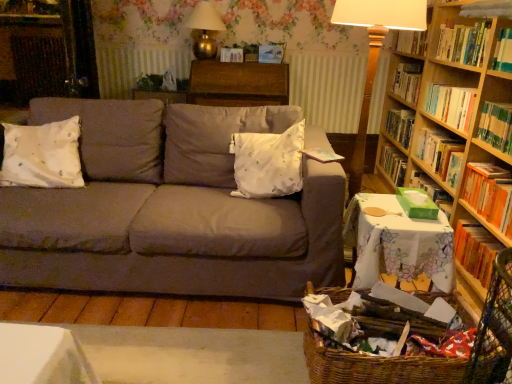
Question: From a real-world perspective, is hardcover book at right, which ranks as the first book in bottom-to-top order, positioned over woven brown basket at lower right based on gravity?

Choices:
 (A) no
 (B) yes

Answer: (B)

Question: Does hardcover book at right, which ranks as the first book in bottom-to-top order, contain woven brown basket at lower right?

Choices:
 (A) yes
 (B) no

Answer: (B)

Question: Is hardcover book at right, which ranks as the first book in bottom-to-top order, closer to the viewer compared to woven brown basket at lower right?

Choices:
 (A) yes
 (B) no

Answer: (B)

Question: From a real-world perspective, does hardcover book at right, which ranks as the first book in bottom-to-top order, sit lower than woven brown basket at lower right?

Choices:
 (A) yes
 (B) no

Answer: (B)

Question: Is hardcover book at right, which is counted as the 4th book, starting from the top, bigger than woven brown basket at lower right?

Choices:
 (A) yes
 (B) no

Answer: (B)

Question: Is hardcover book at right, which ranks as the first book in bottom-to-top order, thinner than woven brown basket at lower right?

Choices:
 (A) no
 (B) yes

Answer: (B)

Question: Can you confirm if wooden table lamp at right, the first table lamp from the right, is positioned to the left of hardwood bookshelf at upper right?

Choices:
 (A) no
 (B) yes

Answer: (B)

Question: Is wooden table lamp at right, the first table lamp from the right, at the right side of hardwood bookshelf at upper right?

Choices:
 (A) yes
 (B) no

Answer: (B)

Question: Is wooden table lamp at right, the second table lamp positioned from the back, in contact with hardwood bookshelf at upper right?

Choices:
 (A) yes
 (B) no

Answer: (B)

Question: Considering the relative sizes of wooden table lamp at right, the second table lamp positioned from the back, and hardwood bookshelf at upper right in the image provided, is wooden table lamp at right, the second table lamp positioned from the back, shorter than hardwood bookshelf at upper right?

Choices:
 (A) yes
 (B) no

Answer: (B)

Question: From a real-world perspective, is wooden table lamp at right, the first table lamp from the right, located beneath hardwood bookshelf at upper right?

Choices:
 (A) yes
 (B) no

Answer: (A)

Question: Is wooden table lamp at right, placed as the second table lamp when sorted from left to right, surrounding hardwood bookshelf at upper right?

Choices:
 (A) yes
 (B) no

Answer: (B)

Question: Does wooden table at center, placed as the first table when sorted from top to bottom, touch hardcover book at right, which is counted as the 4th book, starting from the top?

Choices:
 (A) no
 (B) yes

Answer: (A)